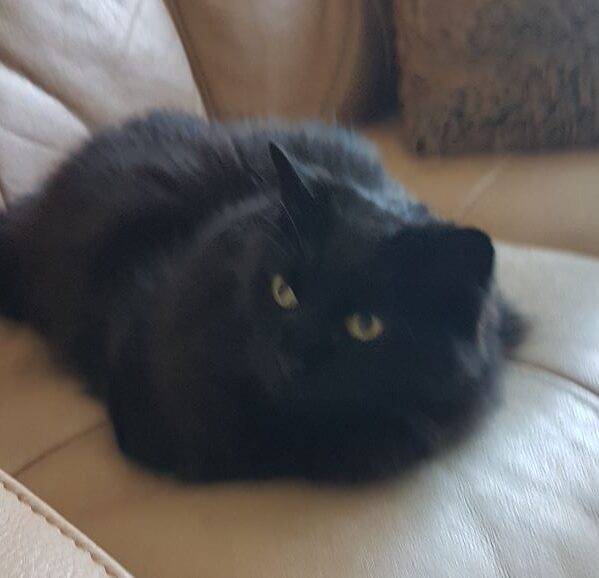
Identify the location of vertical seam of back couch. This screenshot has width=599, height=578. (485, 184).